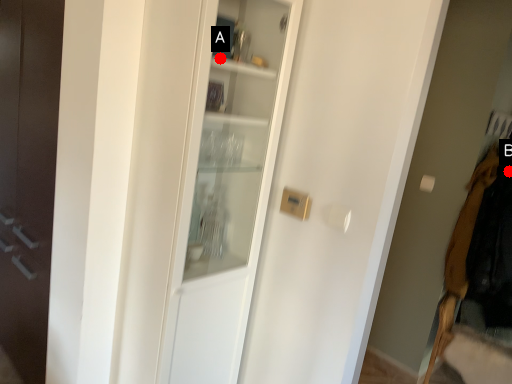
Question: Two points are circled on the image, labeled by A and B beside each circle. Among these points, which one is nearest to the camera?

Choices:
 (A) A is closer
 (B) B is closer

Answer: (A)